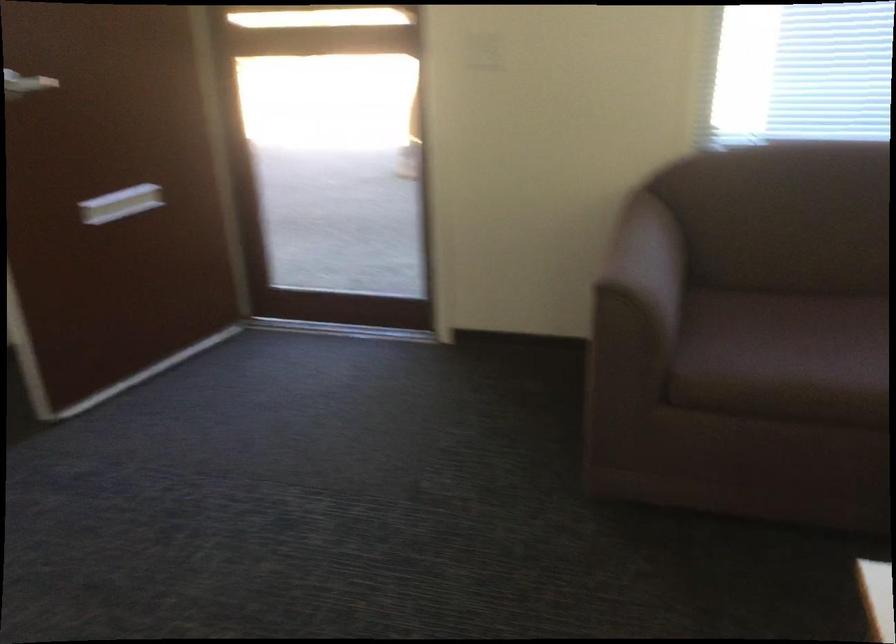
Find where to sit the sofa sitting surface. Please return your answer as a coordinate pair (x, y).

(786, 337)